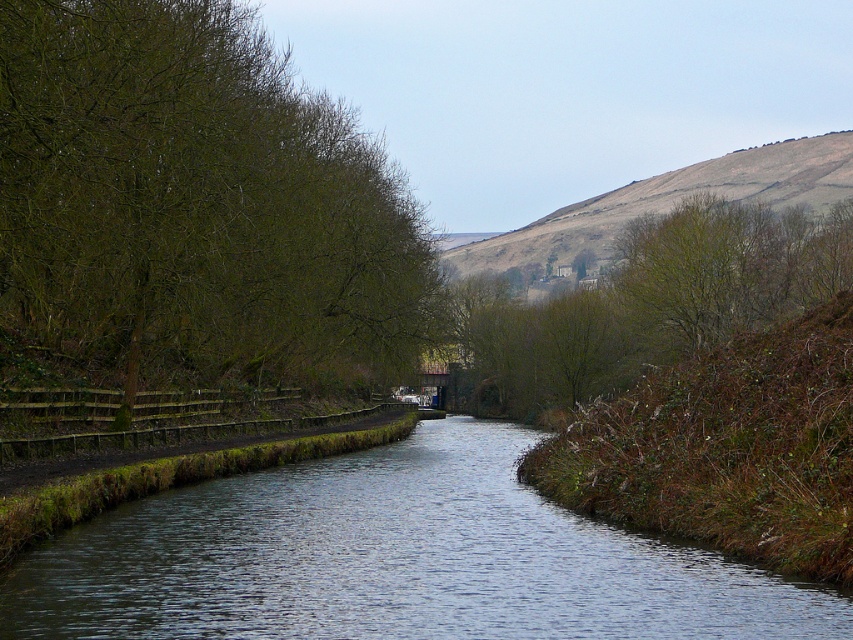
From the picture: You are standing on the wooden walkway on the left side of the canal and want to reach the brown grassy hillside at upper center. Which direction should you walk to get there from the smooth concrete canal at center?

You should walk to the right from the smooth concrete canal at center because it is to the left of the brown grassy hillside at upper center, so moving right will lead you towards the hillside.

You are a bird looking for a higher perch to get a better view of the canal. Which tree would you choose between the green leafy tree at left and the green leafy tree at upper center?

The green leafy tree at left is taller than the green leafy tree at upper center, so the bird should choose the green leafy tree at left for a higher perch.

From the picture: You are standing on the wooden walkway at the left side of the canal and want to look towards the green leafy tree at upper center. Which direction should you turn your head to see the green leafy tree at left?

The green leafy tree at left is located above the green leafy tree at upper center, so you should look upwards to see the green leafy tree at left.